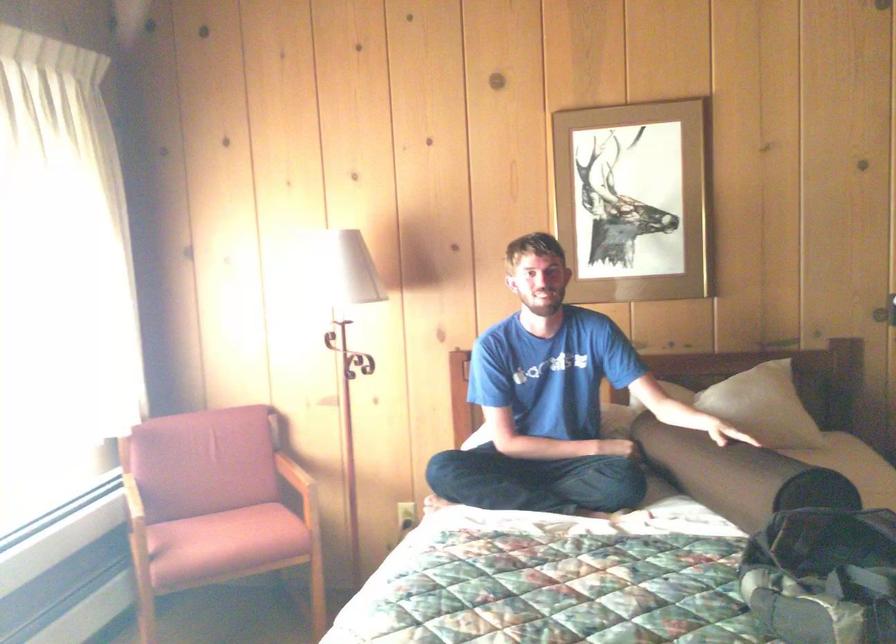
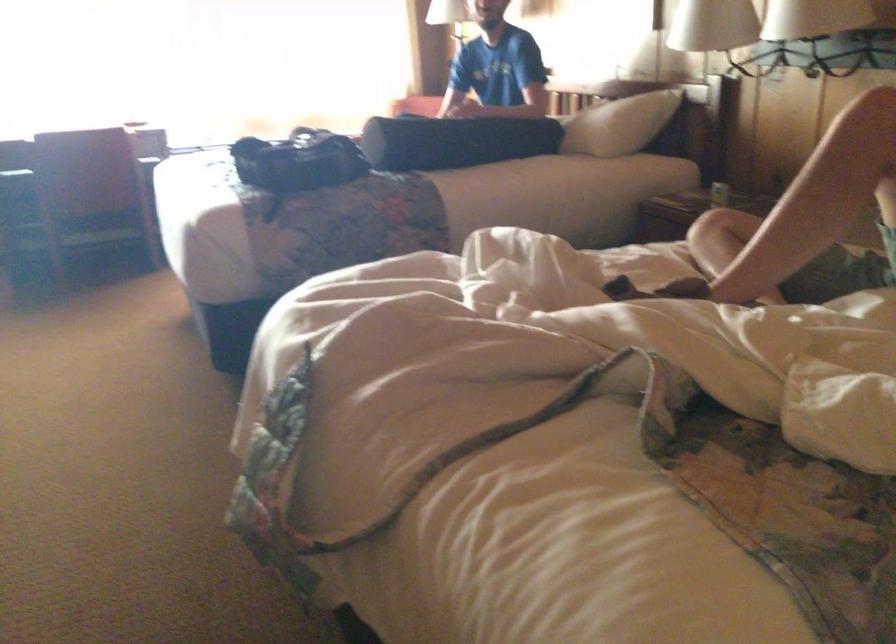
Question: I am providing you with two images of the same scene from different viewpoints. Which of the following objects are not visible in image2?

Choices:
 (A) chair sitting surface
 (B) black bag
 (C) black bolster pillow
 (D) small wooden book

Answer: (A)